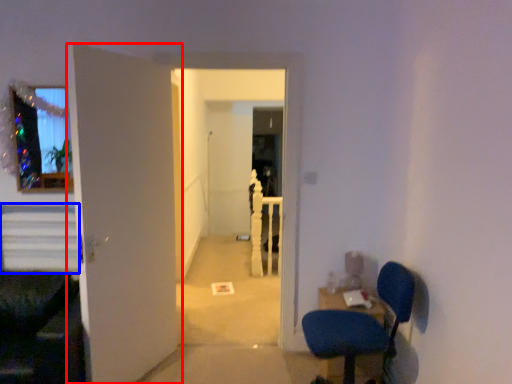
Question: Among these objects, which one is nearest to the camera, door (highlighted by a red box) or stairs (highlighted by a blue box)?

Choices:
 (A) door
 (B) stairs

Answer: (A)